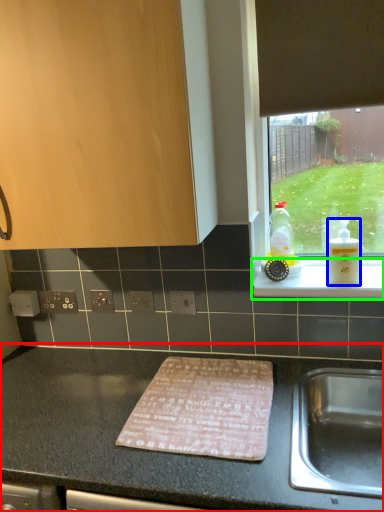
Question: Which object is the closest to the countertop (highlighted by a red box)? Choose among these: bottle (highlighted by a blue box) or ledge (highlighted by a green box).

Choices:
 (A) bottle
 (B) ledge

Answer: (B)